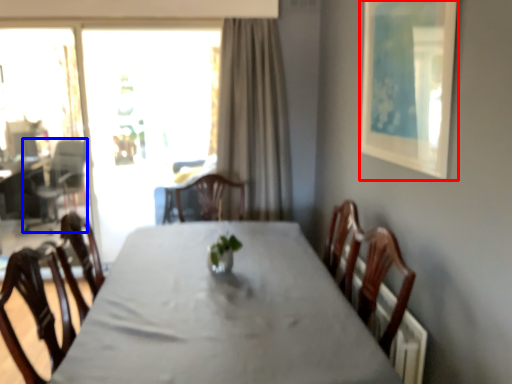
Question: Among these objects, which one is farthest to the camera, picture frame (highlighted by a red box) or armchair (highlighted by a blue box)?

Choices:
 (A) picture frame
 (B) armchair

Answer: (B)